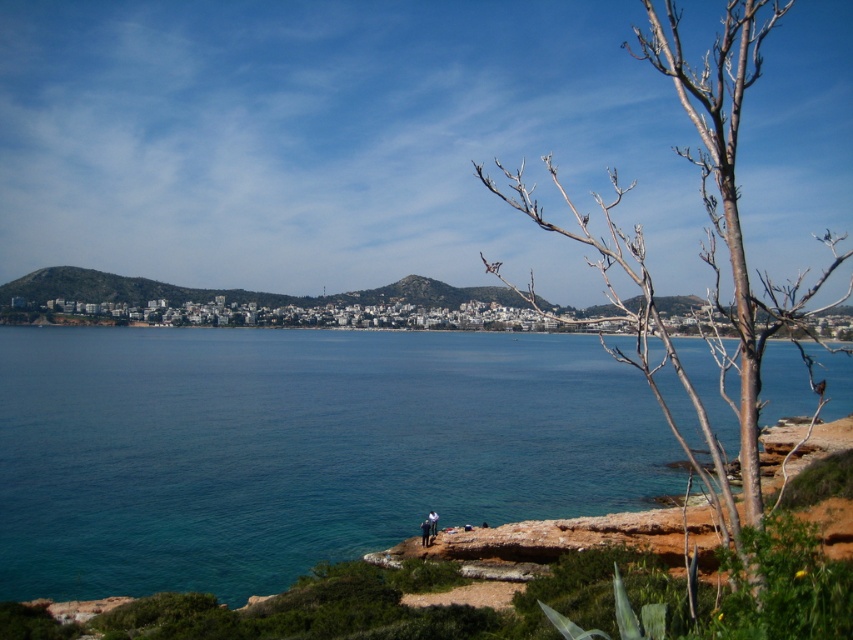
Question: Is the position of blue water at center less distant than that of dark blue jeans at lower center?

Choices:
 (A) yes
 (B) no

Answer: (A)

Question: Which point is farther to the camera?

Choices:
 (A) (749, 61)
 (B) (426, 545)
 (C) (180, 380)

Answer: (C)

Question: Which of these objects is positioned farthest from the white cotton shirt at lower center?

Choices:
 (A) dark blue jeans at lower center
 (B) bare wood tree at right

Answer: (B)

Question: Based on their relative distances, which object is farther from the white cotton shirt at lower center?

Choices:
 (A) blue water at center
 (B) bare wood tree at right
 (C) dark blue jeans at lower center

Answer: (B)

Question: Does bare wood tree at right appear over white cotton shirt at lower center?

Choices:
 (A) no
 (B) yes

Answer: (B)

Question: Is dark blue jeans at lower center wider than white cotton shirt at lower center?

Choices:
 (A) yes
 (B) no

Answer: (A)